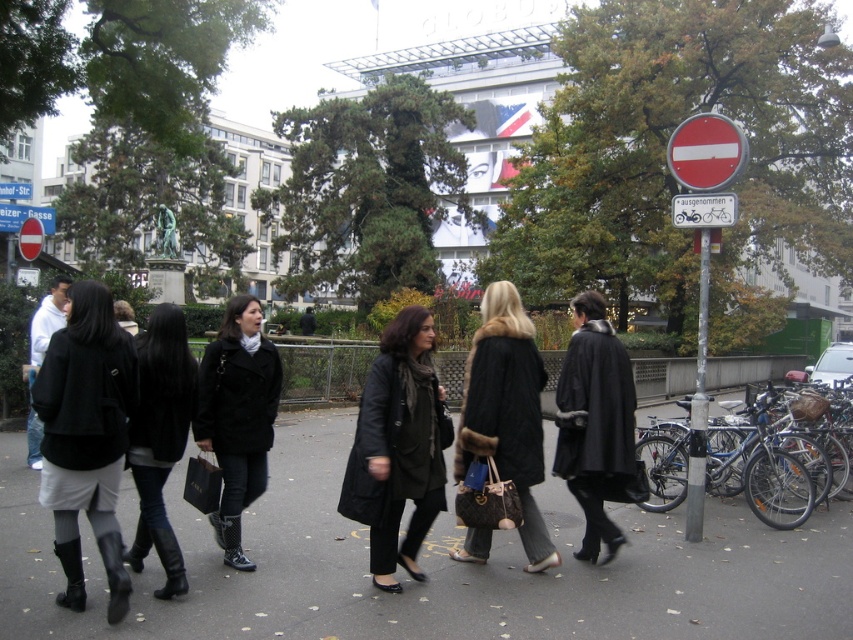
You are a photographer standing in the pedestrian area. You want to take a photo of the black matte coat at center and the red plastic sign at upper center. Which object should you adjust your camera to focus on first if you want to capture both in the same frame without moving the camera?

The black matte coat at center is to the right of the red plastic sign at upper center, so you should focus on the red plastic sign at upper center first to ensure both objects are in the frame without moving the camera.

You are a photographer trying to capture the black matte coat at center without the red plastic sign at upper center blocking the view. Is this possible given their positions?

The black matte coat at center is positioned under the red plastic sign at upper center, so the sign will block the view of the coat unless the photographer moves to a lower angle or position to avoid the obstruction.

You are a photographer standing in the pedestrian area and want to take a photo of the brown fur coat at center. According to the scene description, where should you position yourself to capture the coat in the frame?

The brown fur coat at center is located at coordinates 0.644 on the x axis and 0.594 on the y axis, so you should position yourself facing the center area where the coat is located to capture it in the frame.